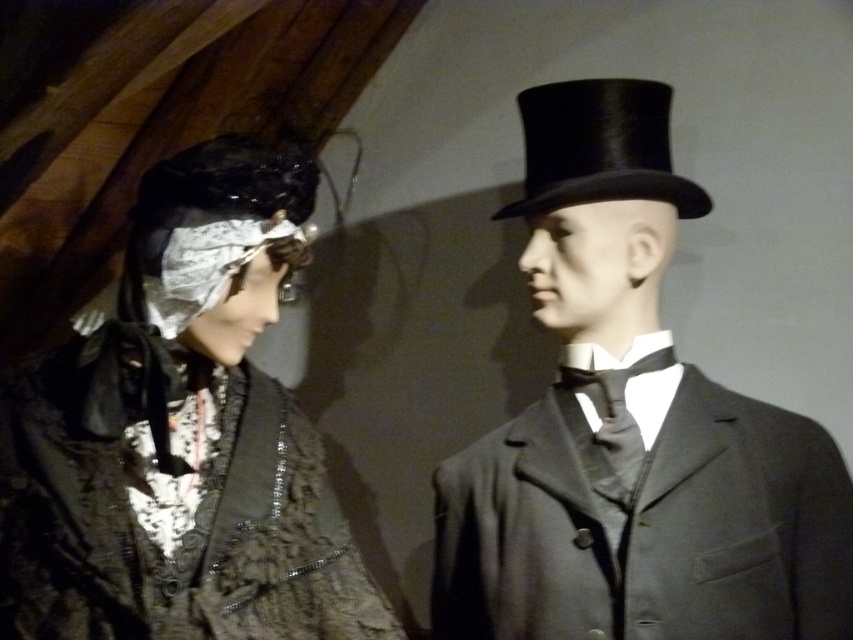
Looking at this image, you are a tailor standing between the shiny black top hat at right and the matte black lace dress at left. Which object is closer to you?

The shiny black top hat at right is closer to you because it is further to the viewer than the matte black lace dress at left.

You are a tailor measuring the height of two items in a historical display. You need to determine which item is taller between the shiny black top hat at right and the matte black lace dress at left. Can you tell me which one is taller?

The shiny black top hat at right is taller than the matte black lace dress at left according to the description.